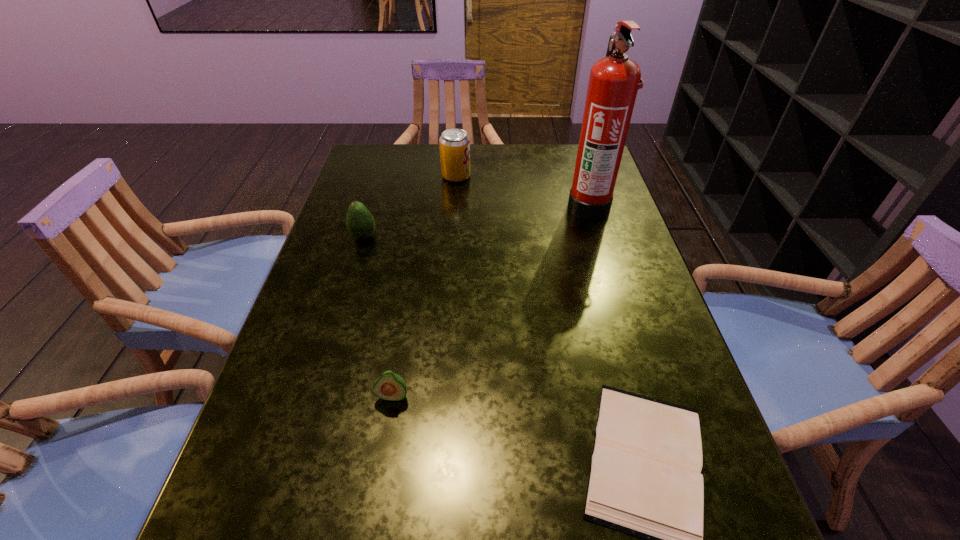
At what (x,y) coordinates should I click in order to perform the action: click on the fourth closest object to the left avocado. Please return your answer as a coordinate pair (x, y). This screenshot has width=960, height=540. Looking at the image, I should click on (645, 480).